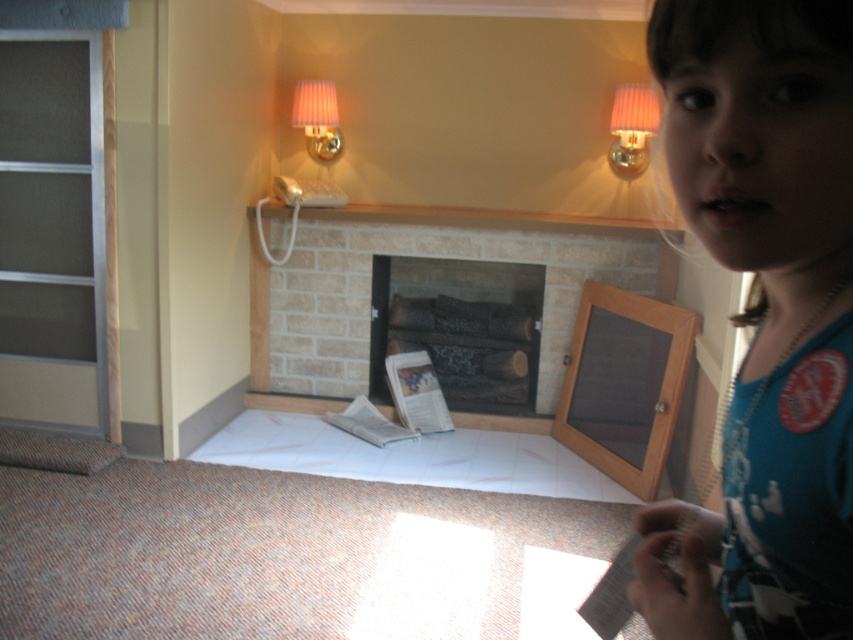
Based on the photo, can you confirm if blue cotton shirt at upper right is positioned to the right of charcoal wood logs at center?

Yes, blue cotton shirt at upper right is to the right of charcoal wood logs at center.

Measure the distance between point (788, 160) and camera.

Point (788, 160) is 19.10 inches away from camera.

I want to click on blue cotton shirt at upper right, so click(764, 312).

Does pink fabric lampshade at upper right appear on the right side of pink fabric lampshade at upper center?

Indeed, pink fabric lampshade at upper right is positioned on the right side of pink fabric lampshade at upper center.

Does pink fabric lampshade at upper right appear on the left side of pink fabric lampshade at upper center?

In fact, pink fabric lampshade at upper right is to the right of pink fabric lampshade at upper center.

Between point (646, 156) and point (332, 148), which one is positioned in front?

Point (646, 156)

Locate an element on the screen. This screenshot has height=640, width=853. pink fabric lampshade at upper right is located at coordinates (631, 128).

Between point (432, 340) and point (337, 148), which one is positioned in front?

Point (432, 340) is in front.

The height and width of the screenshot is (640, 853). What do you see at coordinates (460, 328) in the screenshot?
I see `charcoal wood logs at center` at bounding box center [460, 328].

This screenshot has width=853, height=640. I want to click on charcoal wood logs at center, so click(460, 328).